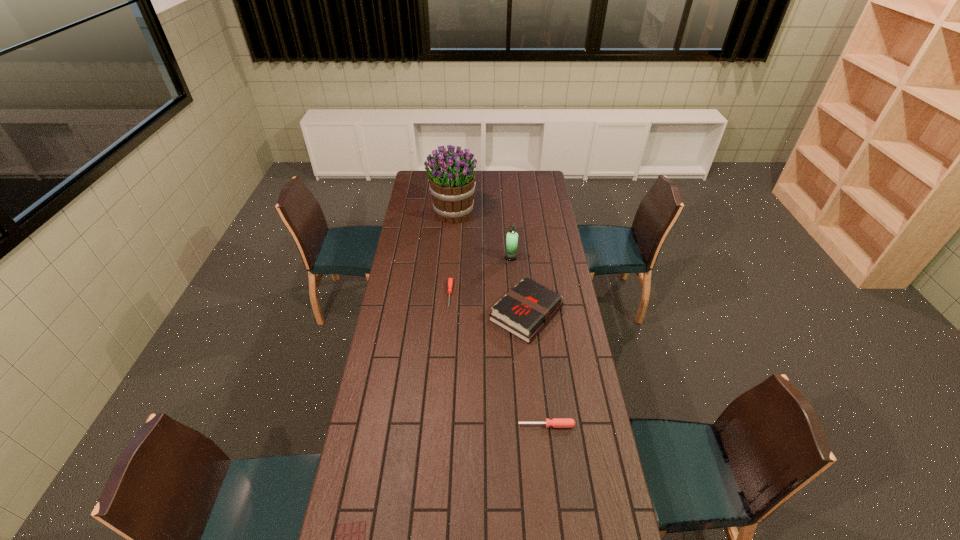
The image size is (960, 540). Identify the location of the tallest object. (452, 181).

Locate an element on the screen. bouquet is located at coordinates (452, 181).

In order to click on thermos bottle in this screenshot , I will do tap(512, 237).

Identify the location of the fifth nearest object. [512, 237].

Locate an element on the screen. Image resolution: width=960 pixels, height=540 pixels. hardback book is located at coordinates (527, 308).

Identify the location of the second nearest object. (555, 422).

Locate an element on the screen. the third shortest object is located at coordinates (555, 422).

At what (x,y) coordinates should I click in order to perform the action: click on the farther screwdriver. Please return your answer as a coordinate pair (x, y). This screenshot has width=960, height=540. Looking at the image, I should click on (450, 280).

Where is `the shorter screwdriver`? Image resolution: width=960 pixels, height=540 pixels. the shorter screwdriver is located at coordinates (450, 280).

What are the coordinates of `free location located 0.250m on the front of the farthest object` in the screenshot? It's located at (450, 257).